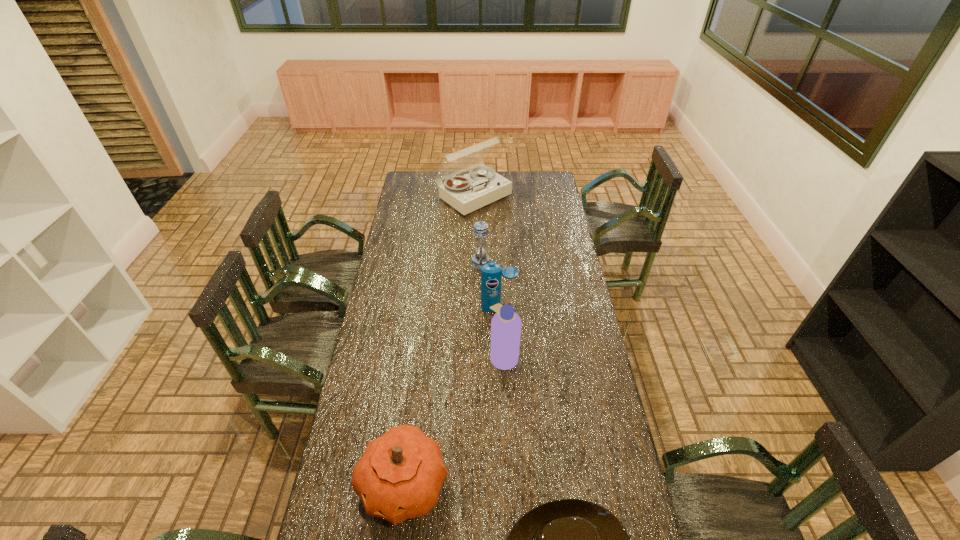
The image size is (960, 540). I want to click on vacant space located 0.250m on the front-facing side of the lantern, so click(x=419, y=262).

Locate an element on the screen. object situated at the far edge is located at coordinates (467, 193).

Where is `object present at the left edge`? object present at the left edge is located at coordinates (399, 476).

Image resolution: width=960 pixels, height=540 pixels. I want to click on free location at the left edge of the desktop, so click(414, 215).

Where is `free region at the right edge of the desktop`? The image size is (960, 540). free region at the right edge of the desktop is located at coordinates (536, 195).

Locate an element on the screen. Image resolution: width=960 pixels, height=540 pixels. blank region between the pumpkin and the nearer shampoo is located at coordinates (454, 420).

This screenshot has width=960, height=540. I want to click on free space between the pumpkin and the third farthest object, so click(451, 396).

Where is `free spot between the pumpkin and the fourth nearest object`? free spot between the pumpkin and the fourth nearest object is located at coordinates (451, 396).

Locate an element on the screen. The width and height of the screenshot is (960, 540). unoccupied area between the pumpkin and the farther shampoo is located at coordinates (451, 396).

At what (x,y) coordinates should I click in order to perform the action: click on the closest object relative to the shortest object. Please return your answer as a coordinate pair (x, y). Looking at the image, I should click on pos(399,476).